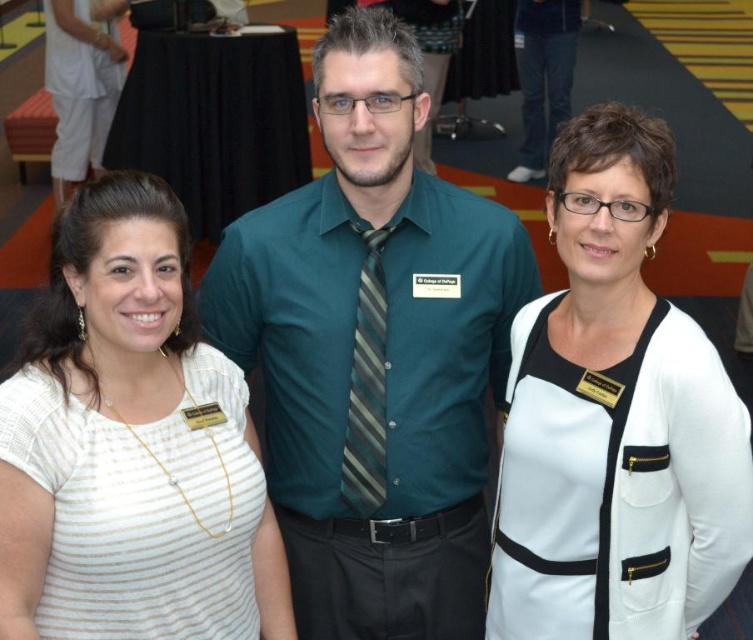
You are a photographer at the event and need to position yourself so that both the teal shirt at center and the white striped shirt at left are visible in the frame. Considering their heights, which one might you need to adjust your camera angle for to ensure both are fully captured?

The teal shirt at center is much taller than the white striped shirt at left, so you might need to adjust your camera angle downward to capture the taller teal shirt at center while still including the shorter white striped shirt at left in the frame.

Based on the photo, based on the scene description, where is the teal shirt at center located in terms of coordinates?

The teal shirt at center is located at coordinates point (x=373, y=353).

Based on the scene description, which object is positioned higher between the white matte cardigan at center and the white striped shirt at left?

The white matte cardigan at center is positioned higher than the white striped shirt at left.